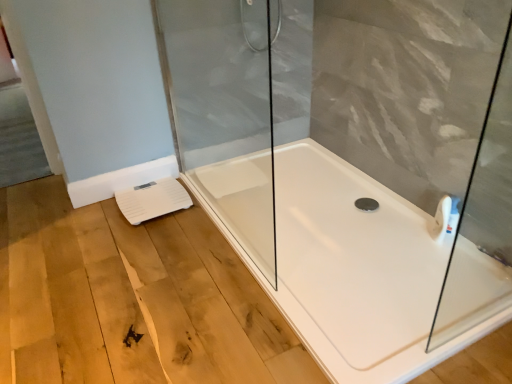
Question: From a real-world perspective, is transparent glass shower door at center below white plastic scale at lower left?

Choices:
 (A) yes
 (B) no

Answer: (B)

Question: Could white plastic scale at lower left be considered to be inside transparent glass shower door at center?

Choices:
 (A) no
 (B) yes

Answer: (A)

Question: Would you consider transparent glass shower door at center to be distant from white plastic scale at lower left?

Choices:
 (A) no
 (B) yes

Answer: (A)

Question: Considering the relative sizes of transparent glass shower door at center and white plastic scale at lower left in the image provided, is transparent glass shower door at center thinner than white plastic scale at lower left?

Choices:
 (A) yes
 (B) no

Answer: (A)

Question: Can we say transparent glass shower door at center lies outside white plastic scale at lower left?

Choices:
 (A) yes
 (B) no

Answer: (A)

Question: Does transparent glass shower door at center have a greater height compared to white plastic scale at lower left?

Choices:
 (A) yes
 (B) no

Answer: (A)

Question: Is white plastic scale at lower left positioned before white glossy bathtub at center?

Choices:
 (A) no
 (B) yes

Answer: (A)

Question: From a real-world perspective, is white plastic scale at lower left under white glossy bathtub at center?

Choices:
 (A) no
 (B) yes

Answer: (A)

Question: Is white plastic scale at lower left next to white glossy bathtub at center?

Choices:
 (A) yes
 (B) no

Answer: (B)

Question: Could you tell me if white plastic scale at lower left is facing white glossy bathtub at center?

Choices:
 (A) no
 (B) yes

Answer: (B)

Question: Considering the relative positions of white plastic scale at lower left and white glossy bathtub at center in the image provided, is white plastic scale at lower left to the right of white glossy bathtub at center from the viewer's perspective?

Choices:
 (A) no
 (B) yes

Answer: (A)

Question: Does white plastic scale at lower left have a lesser height compared to white glossy bathtub at center?

Choices:
 (A) no
 (B) yes

Answer: (A)

Question: Is transparent glass shower door at center not within white glossy bathtub at center?

Choices:
 (A) no
 (B) yes

Answer: (B)